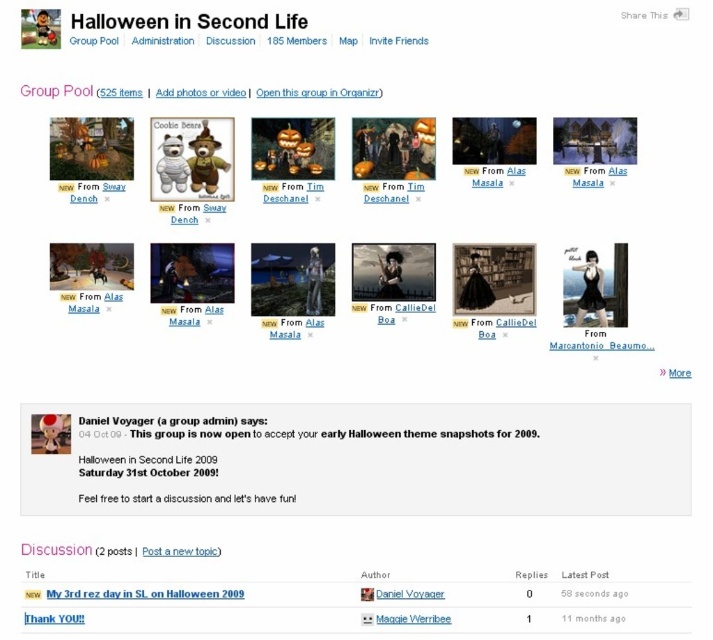
Question: Does matte black witch at center lie in front of black matte text at upper center?

Choices:
 (A) yes
 (B) no

Answer: (B)

Question: Among these objects, which one is farthest from the camera?

Choices:
 (A) gray matte text at center
 (B) matte black witch at center
 (C) black matte text at upper center

Answer: (B)

Question: Can you confirm if black matte text at upper center is positioned above gray matte text at center?

Choices:
 (A) no
 (B) yes

Answer: (B)

Question: Which object appears farthest from the camera in this image?

Choices:
 (A) gray matte text at center
 (B) black matte text at upper center

Answer: (A)

Question: Is matte black witch at center wider than gray matte text at center?

Choices:
 (A) no
 (B) yes

Answer: (B)

Question: Which point is closer to the camera taking this photo?

Choices:
 (A) (441, 616)
 (B) (369, 259)
 (C) (61, 595)

Answer: (C)